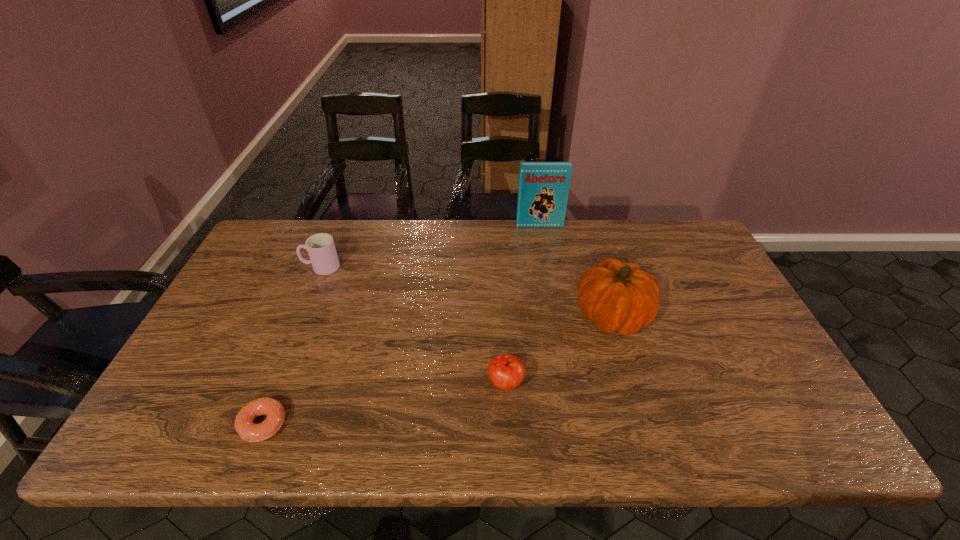
The image size is (960, 540). What are the coordinates of `vacant space located 0.190m on the left of the pumpkin` in the screenshot? It's located at (506, 315).

Locate an element on the screen. The width and height of the screenshot is (960, 540). free space located 0.110m with the handle on the side of the cup is located at coordinates (267, 267).

The width and height of the screenshot is (960, 540). What are the coordinates of `free space located with the handle on the side of the cup` in the screenshot? It's located at (257, 267).

Locate an element on the screen. The image size is (960, 540). vacant point located 0.130m with the handle on the side of the cup is located at coordinates (260, 267).

Identify the location of free location located on the left of the apple. (400, 383).

This screenshot has height=540, width=960. Find the location of `vacant point located 0.250m on the back of the doughnut`. vacant point located 0.250m on the back of the doughnut is located at coordinates (303, 323).

Where is `book positioned at the far edge`? This screenshot has width=960, height=540. book positioned at the far edge is located at coordinates (543, 188).

Find the location of `cup that is at the far edge`. cup that is at the far edge is located at coordinates (321, 248).

You are a GUI agent. You are given a task and a screenshot of the screen. Output one action in this format:
    pyautogui.click(x=<x>, y=<y>)
    Task: Click on the object present at the near edge
    The height and width of the screenshot is (540, 960).
    Given the screenshot: What is the action you would take?
    pyautogui.click(x=247, y=430)

Locate an element on the screen. free space at the far edge is located at coordinates tap(382, 241).